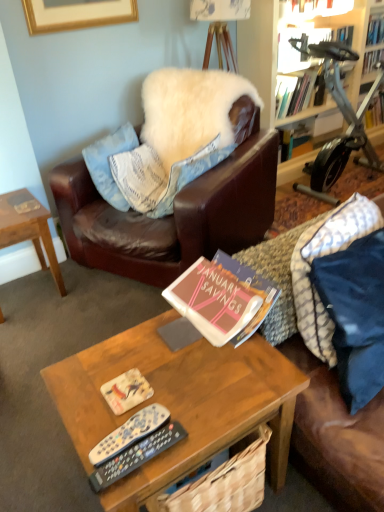
Image resolution: width=384 pixels, height=512 pixels. What are the coordinates of `free space in front of matte paper book cover at center` in the screenshot? It's located at (116, 428).